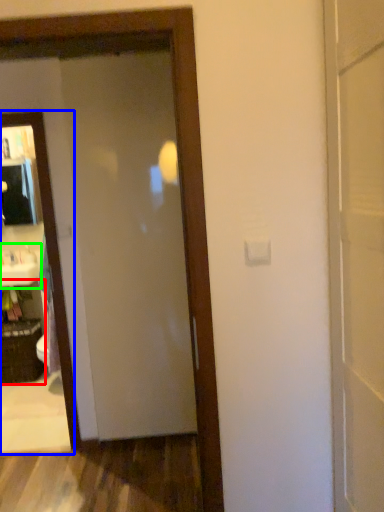
Question: Which object is the farthest from cabinetry (highlighted by a red box)? Choose among these: mirror (highlighted by a blue box) or sink (highlighted by a green box).

Choices:
 (A) mirror
 (B) sink

Answer: (A)